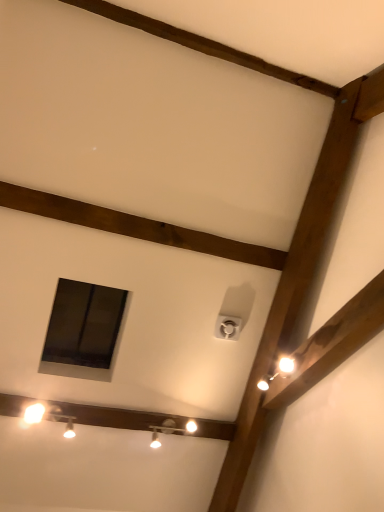
You are a GUI agent. You are given a task and a screenshot of the screen. Output one action in this format:
    pyautogui.click(x=<x>, y=<y>)
    Task: Click on the white glossy spotlight at upper right
    This screenshot has width=384, height=512.
    Given the screenshot: What is the action you would take?
    pyautogui.click(x=278, y=372)

In order to face white glossy spotlight at upper right, should I rotate leftwards or rightwards?

Rotate your view right by about 11.707°.

The image size is (384, 512). Describe the element at coordinates (278, 372) in the screenshot. I see `white glossy spotlight at upper right` at that location.

Identify the location of white glossy spotlight at upper right. (278, 372).